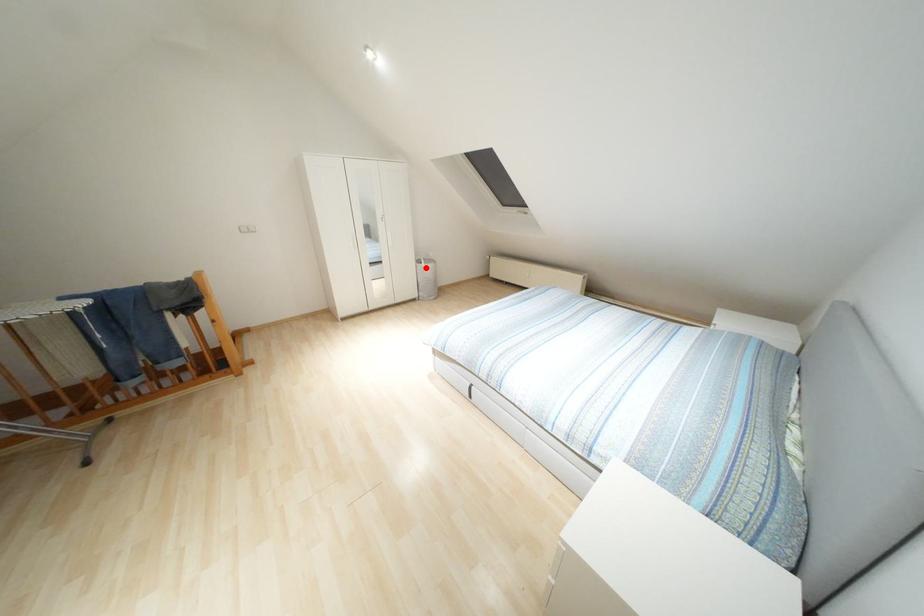
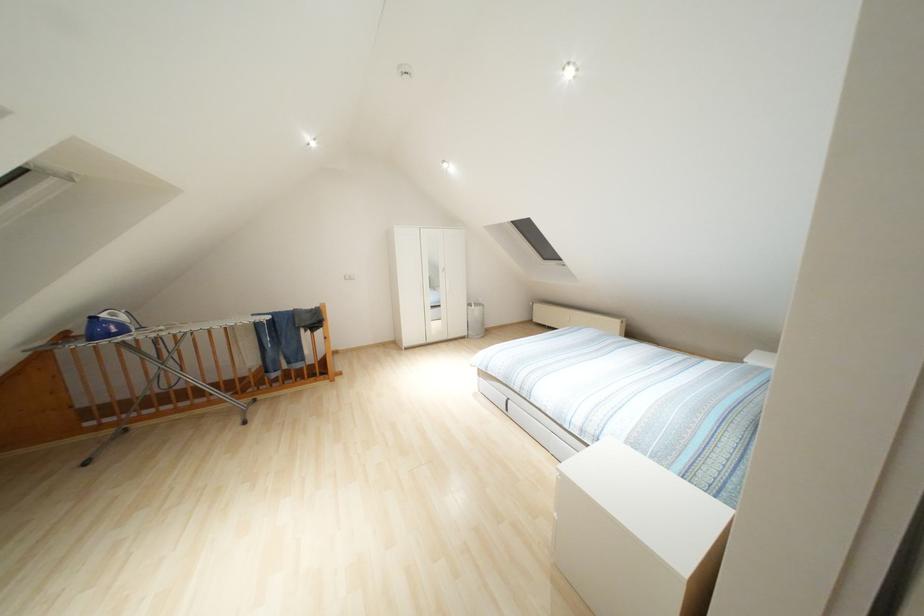
Locate, in the second image, the point that corresponds to the highlighted location in the first image.

(476, 310)